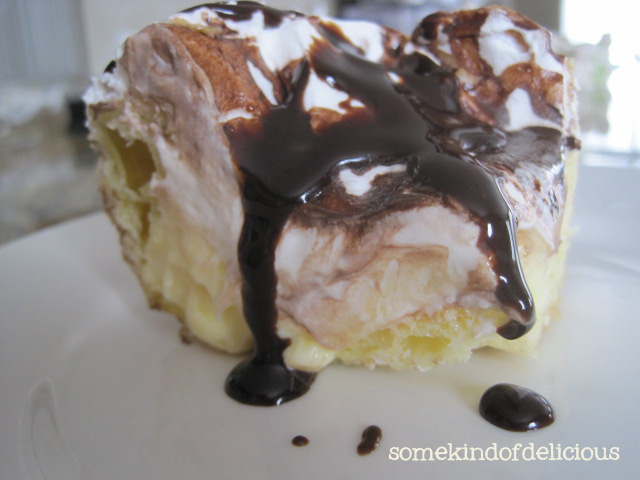
Where is `tabletop`? Image resolution: width=640 pixels, height=480 pixels. tabletop is located at coordinates (82, 346).